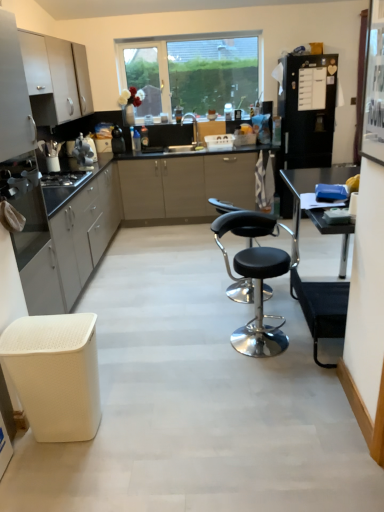
Question: Does satin white cabinets at left, the 4th cabinetry when ordered from bottom to top, lie in front of matte white cabinets at left, which appears as the 4th cabinetry when viewed from the top?

Choices:
 (A) no
 (B) yes

Answer: (A)

Question: Does satin white cabinets at left, the 4th cabinetry when ordered from bottom to top, have a smaller size compared to matte white cabinets at left, which appears as the 4th cabinetry when viewed from the top?

Choices:
 (A) yes
 (B) no

Answer: (A)

Question: Is satin white cabinets at left, which appears as the first cabinetry when viewed from the top, touching matte white cabinets at left, which appears as the 4th cabinetry when viewed from the top?

Choices:
 (A) no
 (B) yes

Answer: (A)

Question: Considering the relative positions of satin white cabinets at left, which appears as the first cabinetry when viewed from the top, and matte white cabinets at left, arranged as the first cabinetry when ordered from the bottom, in the image provided, is satin white cabinets at left, which appears as the first cabinetry when viewed from the top, behind matte white cabinets at left, arranged as the first cabinetry when ordered from the bottom,?

Choices:
 (A) no
 (B) yes

Answer: (B)

Question: From a real-world perspective, is satin white cabinets at left, which appears as the first cabinetry when viewed from the top, beneath matte white cabinets at left, which appears as the 4th cabinetry when viewed from the top?

Choices:
 (A) no
 (B) yes

Answer: (A)

Question: From the image's perspective, is satin white cabinets at left, the 4th cabinetry when ordered from bottom to top, over matte white cabinets at left, which appears as the 4th cabinetry when viewed from the top?

Choices:
 (A) yes
 (B) no

Answer: (A)

Question: From a real-world perspective, is matte white cabinets at left, arranged as the first cabinetry when ordered from the bottom, over white matte cabinet at upper left, which is counted as the second cabinetry, starting from the bottom?

Choices:
 (A) no
 (B) yes

Answer: (A)

Question: Is white matte cabinet at upper left, which is counted as the second cabinetry, starting from the bottom, located within matte white cabinets at left, arranged as the first cabinetry when ordered from the bottom?

Choices:
 (A) no
 (B) yes

Answer: (A)

Question: Can you confirm if matte white cabinets at left, arranged as the first cabinetry when ordered from the bottom, is positioned to the left of white matte cabinet at upper left, positioned as the third cabinetry in top-to-bottom order?

Choices:
 (A) yes
 (B) no

Answer: (B)

Question: Can we say matte white cabinets at left, which appears as the 4th cabinetry when viewed from the top, lies outside white matte cabinet at upper left, which is counted as the second cabinetry, starting from the bottom?

Choices:
 (A) yes
 (B) no

Answer: (A)

Question: Is matte white cabinets at left, arranged as the first cabinetry when ordered from the bottom, smaller than white matte cabinet at upper left, positioned as the third cabinetry in top-to-bottom order?

Choices:
 (A) no
 (B) yes

Answer: (A)

Question: From a real-world perspective, is matte white cabinets at left, arranged as the first cabinetry when ordered from the bottom, physically below white matte cabinet at upper left, which is counted as the second cabinetry, starting from the bottom?

Choices:
 (A) no
 (B) yes

Answer: (B)

Question: From the image's perspective, is white matte cabinet at upper left, which is counted as the second cabinetry, starting from the bottom, below metallic silver toaster at left?

Choices:
 (A) no
 (B) yes

Answer: (A)